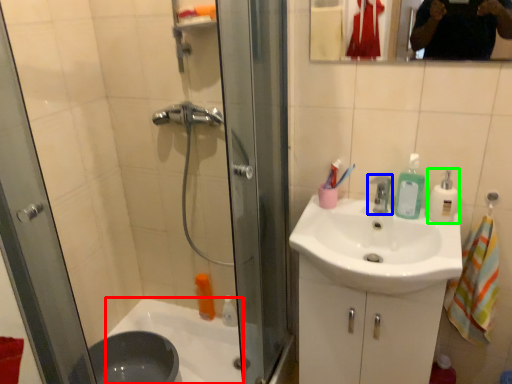
Question: Which object is the farthest from bath (highlighted by a red box)? Choose among these: tap (highlighted by a blue box) or cleaning product (highlighted by a green box).

Choices:
 (A) tap
 (B) cleaning product

Answer: (B)